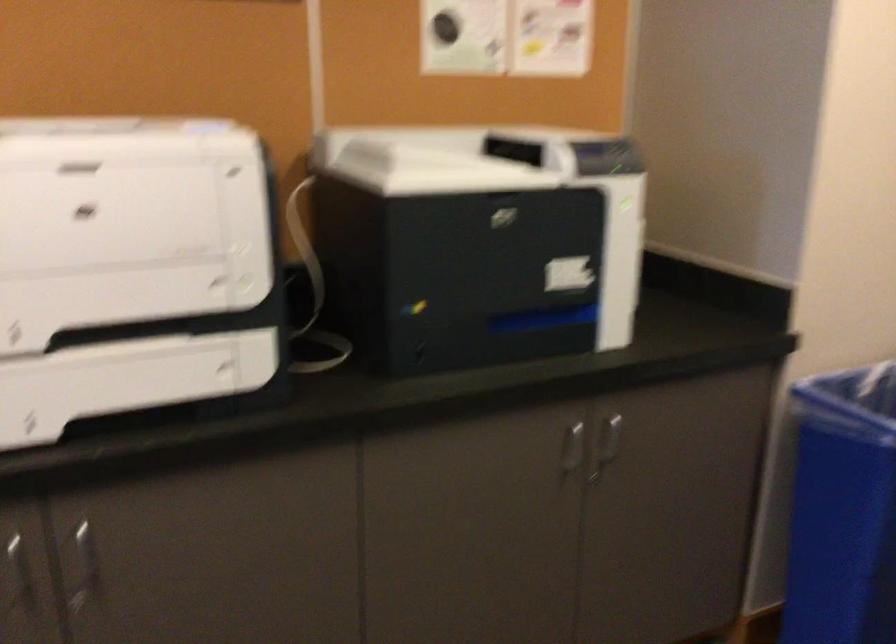
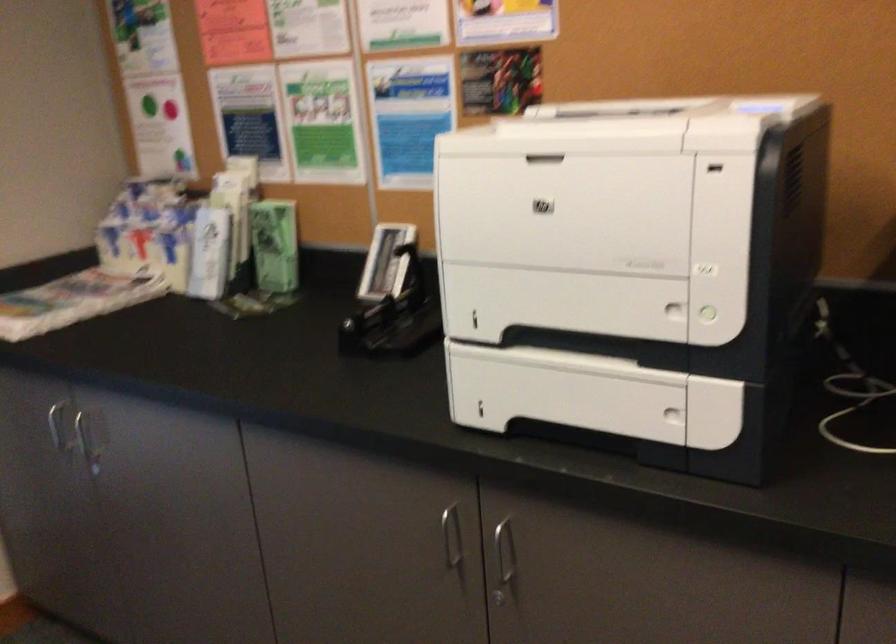
Find the pixel in the second image that matches (82,558) in the first image.

(504, 559)